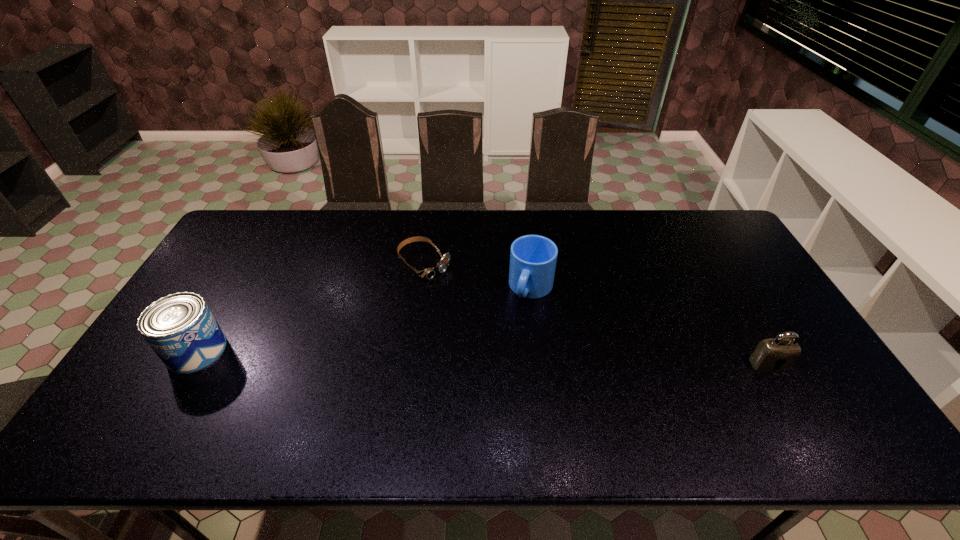
Where is `can`? The width and height of the screenshot is (960, 540). can is located at coordinates tap(180, 328).

Find the location of a particular element. This screenshot has width=960, height=540. the rightmost object is located at coordinates (778, 354).

The image size is (960, 540). What are the coordinates of `mug` in the screenshot? It's located at (533, 258).

The width and height of the screenshot is (960, 540). What are the coordinates of `the second object from left to right` in the screenshot? It's located at (429, 273).

Image resolution: width=960 pixels, height=540 pixels. In order to click on goggles in this screenshot , I will do `click(429, 273)`.

Find the location of `free space located 0.250m on the front label of the can`. free space located 0.250m on the front label of the can is located at coordinates (318, 350).

Where is `vacant space located on the side of the second object from right to left with the handle`? The width and height of the screenshot is (960, 540). vacant space located on the side of the second object from right to left with the handle is located at coordinates (520, 321).

The width and height of the screenshot is (960, 540). I want to click on blank area located on the side of the second object from right to left with the handle, so click(x=510, y=347).

The image size is (960, 540). Identify the location of vacant space located 0.100m on the side of the second object from right to left with the handle. (516, 333).

This screenshot has width=960, height=540. In order to click on vacant region located on the front-facing side of the shortest object in this screenshot , I will do `click(475, 310)`.